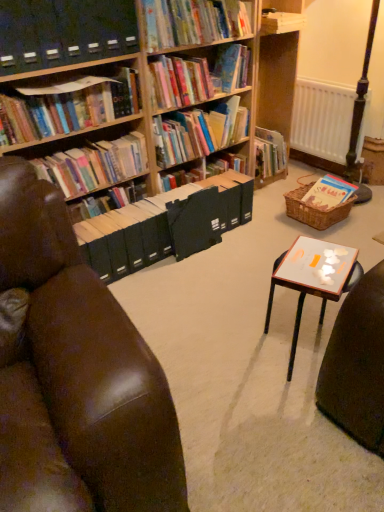
This screenshot has height=512, width=384. Find the location of `free space to the back side of white glossy table at center`. free space to the back side of white glossy table at center is located at coordinates (254, 296).